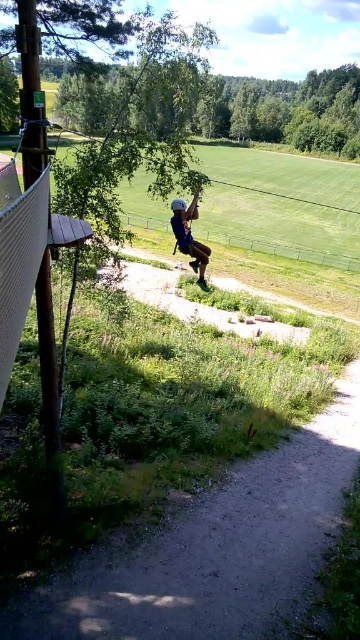
You are a photographer positioned at the camera viewpoint. You want to take a photo of the zip line activity. You have two points marked on your viewfinder at coordinates point (x=240, y=636) and point (x=185, y=228). Which point is closer to you?

Point (x=240, y=636) is closer to the camera than point (x=185, y=228).